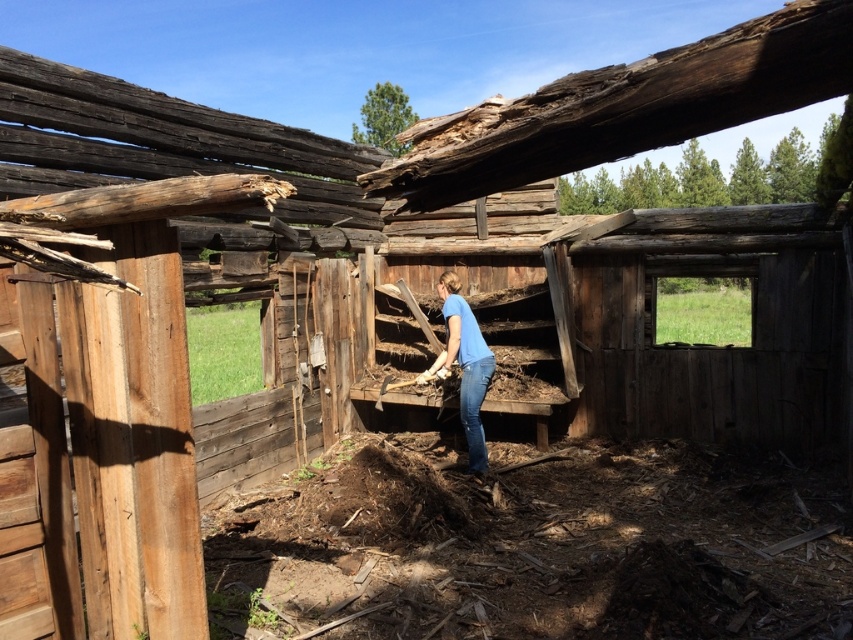
Between point (469, 369) and point (476, 426), which one is positioned in front?

Point (469, 369) is more forward.

Is blue cotton shirt at center above blue denim jeans at center?

Yes.

What do you see at coordinates (463, 365) in the screenshot?
I see `blue cotton shirt at center` at bounding box center [463, 365].

Find the location of a particular element. Image resolution: width=853 pixels, height=640 pixels. blue cotton shirt at center is located at coordinates tap(463, 365).